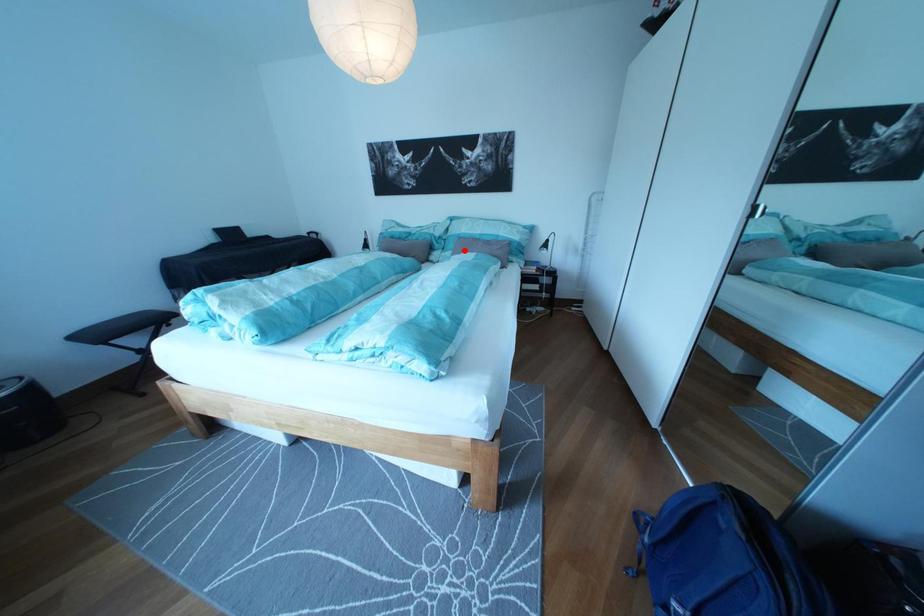
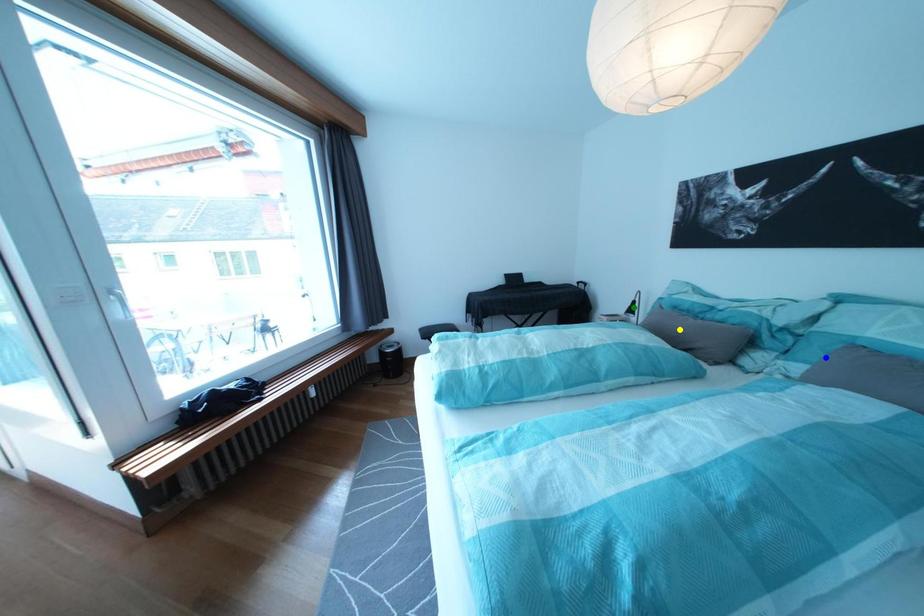
Question: I am providing you with two images of the same scene from different viewpoints. A red point is marked on the first image. You are given multiple points on the second image. Which point in image 2 represents the same 3d spot as the red point in image 1?

Choices:
 (A) yellow point
 (B) blue point
 (C) green point

Answer: (B)